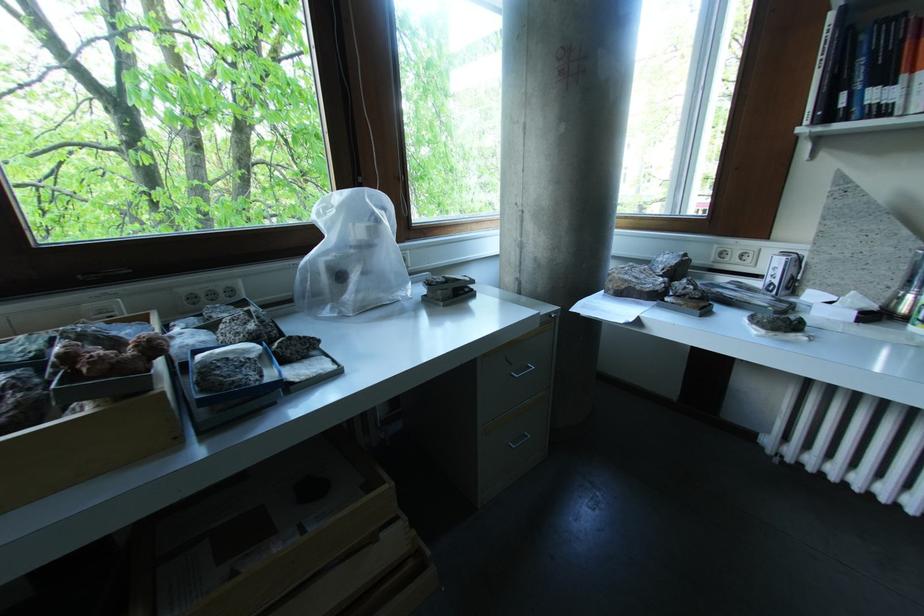
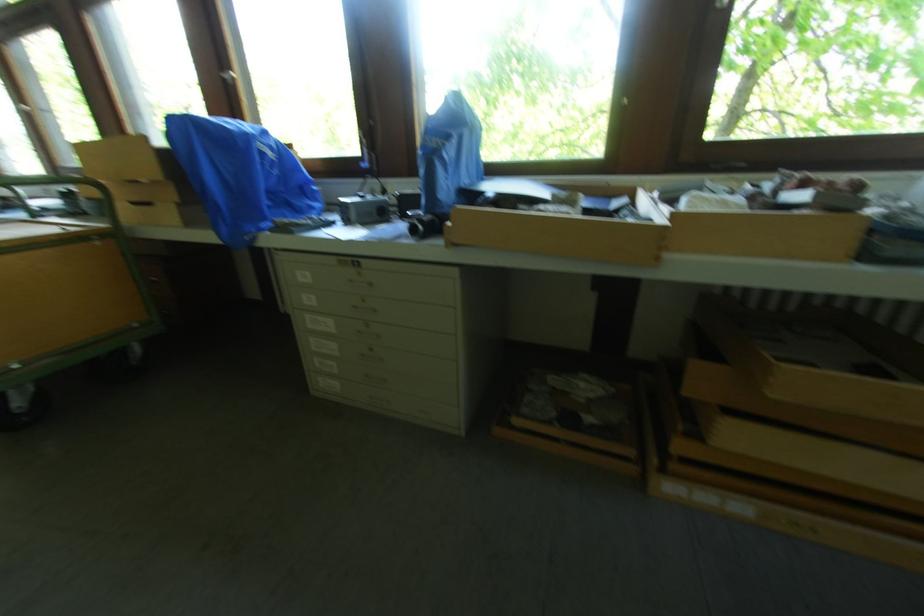
Question: The camera is either moving clockwise (left) or counter-clockwise (right) around the object. The first image is from the beginning of the video and the second image is from the end. Is the camera moving left or right when shooting the video?

Choices:
 (A) Left
 (B) Right

Answer: (B)